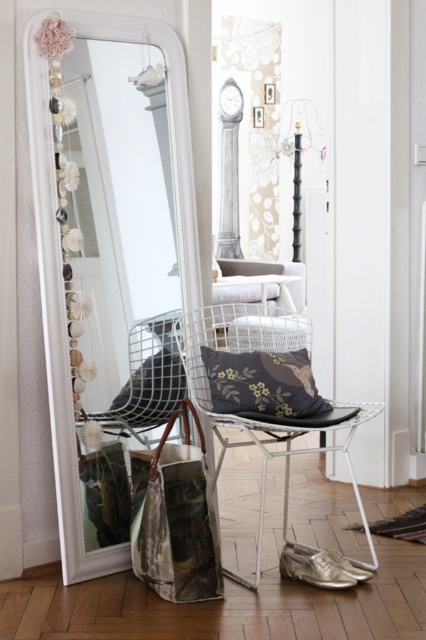
Question: Is white wire chair at center above dark floral-patterned cushion at center?

Choices:
 (A) yes
 (B) no

Answer: (B)

Question: Which point is closer to the camera?

Choices:
 (A) floral-patterned fabric pillow at center
 (B) white woven basket at center
 (C) white glossy mirror at center
 (D) white wire chair at center

Answer: (D)

Question: Considering the real-world distances, which object is closest to the white wire stool at center?

Choices:
 (A) white wire chair at center
 (B) white woven basket at center

Answer: (B)

Question: Among these objects, which one is farthest from the camera?

Choices:
 (A) white woven basket at center
 (B) white wire armchair at center
 (C) white wire chair at center
 (D) white wire stool at center

Answer: (A)

Question: In this image, where is dark floral-patterned cushion at center located relative to white wire stool at center?

Choices:
 (A) above
 (B) below

Answer: (B)

Question: Does white glossy mirror at center appear on the left side of white wire stool at center?

Choices:
 (A) no
 (B) yes

Answer: (B)